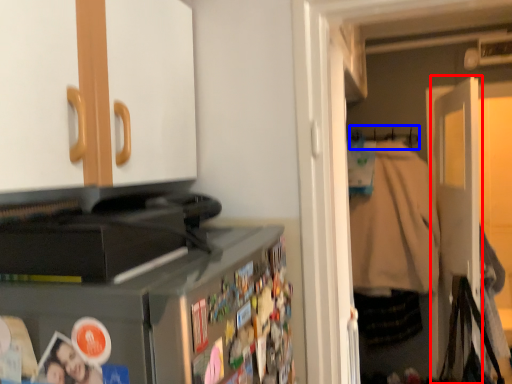
Question: Which object is further to the camera taking this photo, door (highlighted by a red box) or hanger (highlighted by a blue box)?

Choices:
 (A) door
 (B) hanger

Answer: (B)